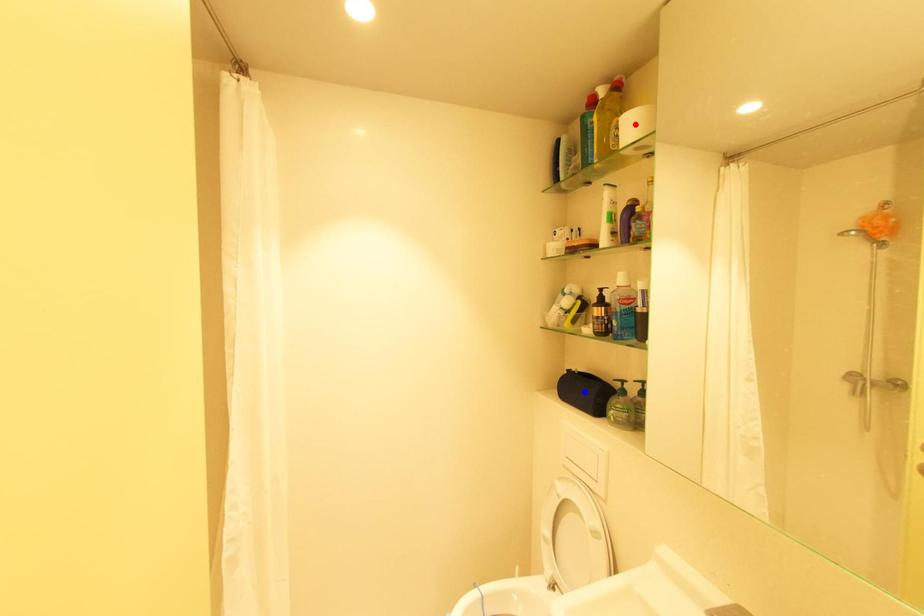
Question: Two points are marked on the image. Which point is closer to the camera?

Choices:
 (A) Blue point is closer.
 (B) Red point is closer.

Answer: (B)